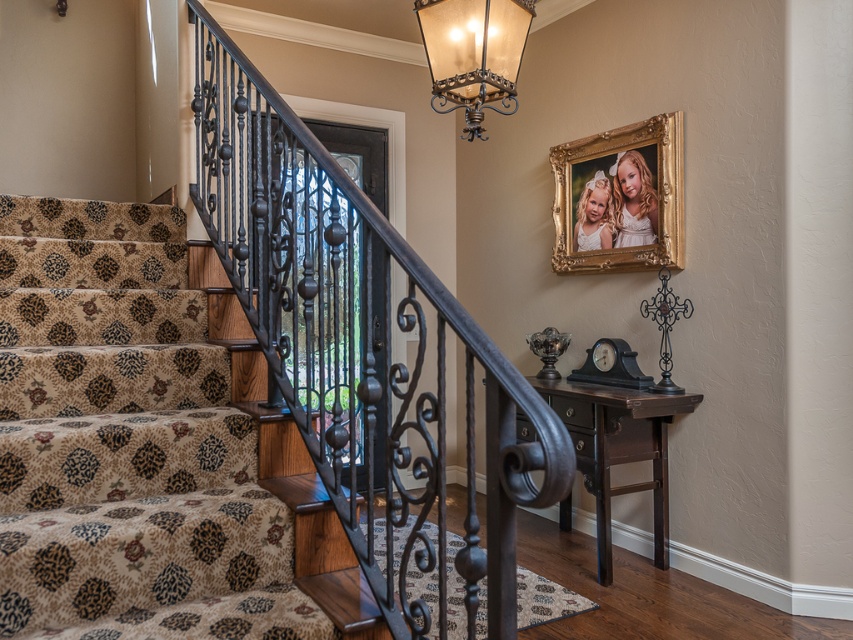
Between patterned carpet at left and metallic brass lantern at upper center, which one appears on the right side from the viewer's perspective?

metallic brass lantern at upper center

The image size is (853, 640). Identify the location of patterned carpet at left. (140, 440).

Who is more distant from viewer, (38, 212) or (491, 64)?

The point (38, 212) is behind.

Locate an element on the screen. patterned carpet at left is located at coordinates (140, 440).

Is gold/gilded picture frame at upper center thinner than metallic brass lantern at upper center?

Incorrect, gold/gilded picture frame at upper center's width is not less than metallic brass lantern at upper center's.

Identify the location of gold/gilded picture frame at upper center. (619, 198).

Is wrought iron railing at left to the right of metallic brass lantern at upper center from the viewer's perspective?

No, wrought iron railing at left is not to the right of metallic brass lantern at upper center.

Does point (317, 273) come farther from viewer compared to point (444, 83)?

Yes, point (317, 273) is farther from viewer.

What do you see at coordinates (358, 342) in the screenshot? The image size is (853, 640). I see `wrought iron railing at left` at bounding box center [358, 342].

Where is `wrought iron railing at left`? wrought iron railing at left is located at coordinates (358, 342).